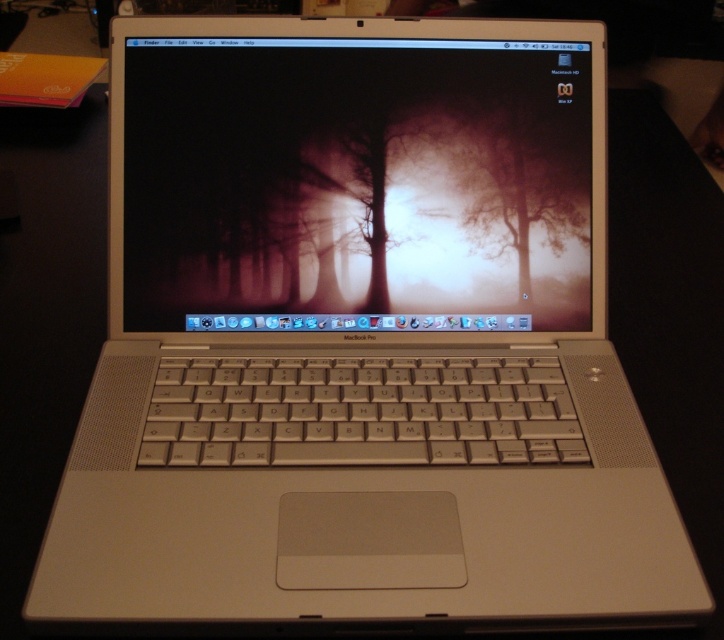
You are setting up a new workspace and want to place a small plant pot between the satin silver laptop at center and the translucent foggy tree at center on your desk. Given that the plant pot is 10 cm wide, can it fit in the space between them?

The satin silver laptop at center is wider than the translucent foggy tree at center. However, the description only provides their widths relative to each other, not the actual distance between them. Without knowing the exact spacing between the two objects, it is impossible to determine if the 10 cm plant pot will fit.

You are looking at the MacBook Pro laptop screen. There is a satin silver laptop at center and a translucent foggy tree at center. Which object is closer to you?

The satin silver laptop at center is closer to the viewer than the translucent foggy tree at center.

You are looking at the MacBook Pro laptop screen. There are two points marked on the screen at coordinates point (177, 144) and point (476, 150). Which point appears closer to you on the screen?

Point (177, 144) is closer to the camera than point (476, 150), so it appears closer to you on the screen.